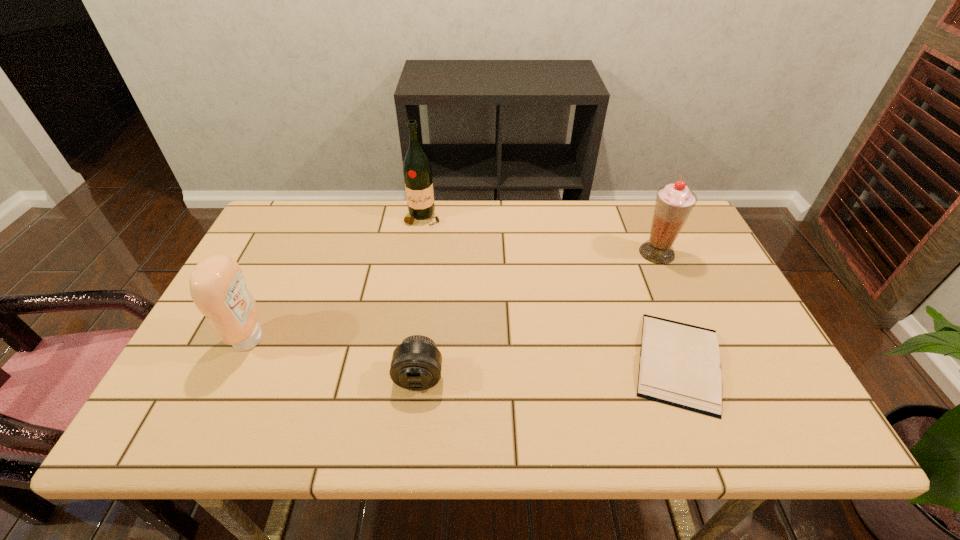
Image resolution: width=960 pixels, height=540 pixels. Identify the location of vacant region at the near edge of the desktop. (493, 419).

Where is `vacant space at the left edge`? The width and height of the screenshot is (960, 540). vacant space at the left edge is located at coordinates (252, 271).

In the image, there is a desktop. At what (x,y) coordinates should I click in order to perform the action: click on free space at the right edge. Please return your answer as a coordinate pair (x, y). Looking at the image, I should click on (724, 341).

You are a GUI agent. You are given a task and a screenshot of the screen. Output one action in this format:
    pyautogui.click(x=<x>, y=<y>)
    Task: Click on the vacant space at the far left corner of the desktop
    
    Given the screenshot: What is the action you would take?
    pyautogui.click(x=295, y=208)

Locate an element on the screen. This screenshot has height=540, width=960. blank area at the far right corner is located at coordinates (642, 206).

You are a GUI agent. You are given a task and a screenshot of the screen. Output one action in this format:
    pyautogui.click(x=<x>, y=<y>)
    Task: Click on the free space between the fourth nearest object and the telephoto lens
    
    Given the screenshot: What is the action you would take?
    pyautogui.click(x=538, y=315)

In order to click on free space between the leftmost object and the shortest object in this screenshot , I will do 464,350.

The height and width of the screenshot is (540, 960). I want to click on vacant area between the second farthest object and the shortest object, so click(x=667, y=307).

The image size is (960, 540). Identify the location of free space between the hardback book and the tallest object. (551, 289).

This screenshot has width=960, height=540. Find the location of `free space between the condiment and the fourth tallest object`. free space between the condiment and the fourth tallest object is located at coordinates (334, 358).